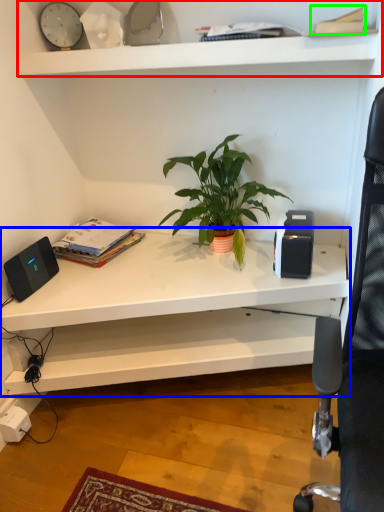
Question: Based on their relative distances, which object is nearer to shelf (highlighted by a red box)? Choose from shelf (highlighted by a blue box) and paperback book (highlighted by a green box).

Choices:
 (A) shelf
 (B) paperback book

Answer: (B)